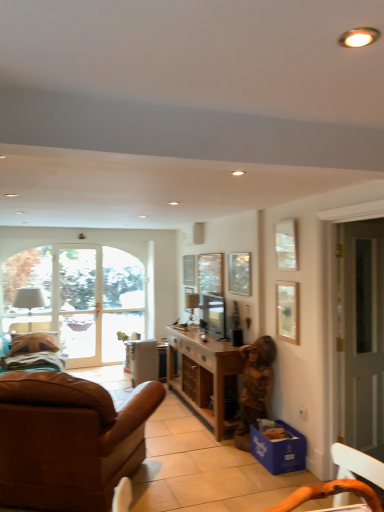
Locate an element on the screen. free space in front of blue cardboard box at lower right is located at coordinates (279, 480).